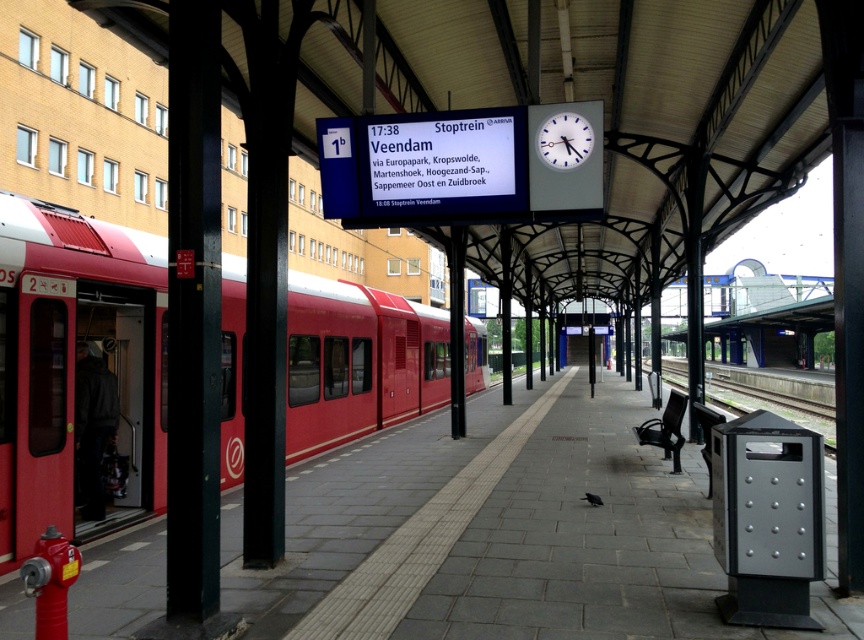
Question: Among these points, which one is farthest from the camera?

Choices:
 (A) (525, 440)
 (B) (7, 365)

Answer: (A)

Question: Can you confirm if smooth concrete platform at center is positioned below matte red train at left?

Choices:
 (A) no
 (B) yes

Answer: (B)

Question: Considering the relative positions of smooth concrete platform at center and matte red train at left in the image provided, where is smooth concrete platform at center located with respect to matte red train at left?

Choices:
 (A) left
 (B) right

Answer: (B)

Question: Which point is farther to the camera?

Choices:
 (A) smooth concrete platform at center
 (B) white plastic clock at upper center

Answer: (B)

Question: Considering the real-world distances, which object is farthest from the matte red train at left?

Choices:
 (A) white plastic clock at upper center
 (B) smooth concrete platform at center

Answer: (A)

Question: Where is smooth concrete platform at center located in relation to matte red train at left in the image?

Choices:
 (A) above
 (B) below

Answer: (B)